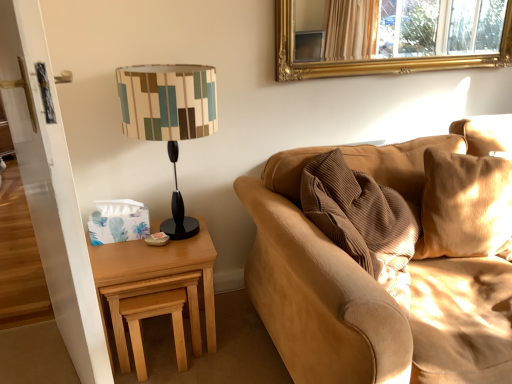
Where is `free spot to the right of light brown wood stool at lower left`? This screenshot has height=384, width=512. free spot to the right of light brown wood stool at lower left is located at coordinates (224, 347).